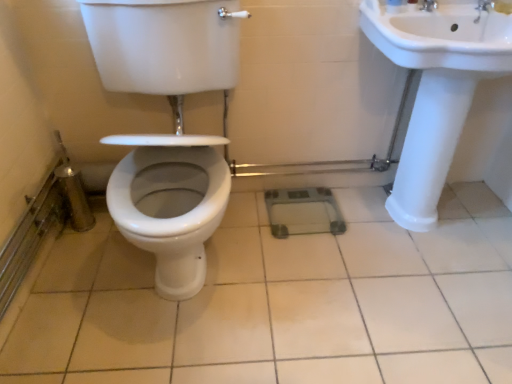
Question: Is white glossy toilet at center positioned behind silver metallic faucet at upper right?

Choices:
 (A) no
 (B) yes

Answer: (A)

Question: From the image's perspective, would you say white glossy toilet at center is shown under silver metallic faucet at upper right?

Choices:
 (A) no
 (B) yes

Answer: (B)

Question: Considering the relative sizes of white glossy toilet at center and silver metallic faucet at upper right in the image provided, is white glossy toilet at center thinner than silver metallic faucet at upper right?

Choices:
 (A) no
 (B) yes

Answer: (A)

Question: Are white glossy toilet at center and silver metallic faucet at upper right located far from each other?

Choices:
 (A) no
 (B) yes

Answer: (B)

Question: Could you tell me if white glossy toilet at center is turned towards silver metallic faucet at upper right?

Choices:
 (A) no
 (B) yes

Answer: (A)

Question: Is white glossy toilet at center bigger than silver metallic faucet at upper right?

Choices:
 (A) no
 (B) yes

Answer: (B)

Question: Is white glossy sink at right far away from silver metallic faucet at upper right?

Choices:
 (A) no
 (B) yes

Answer: (A)

Question: From the image's perspective, is white glossy sink at right on silver metallic faucet at upper right?

Choices:
 (A) no
 (B) yes

Answer: (A)

Question: From the image's perspective, is white glossy sink at right under silver metallic faucet at upper right?

Choices:
 (A) no
 (B) yes

Answer: (B)

Question: Can you confirm if white glossy sink at right is smaller than silver metallic faucet at upper right?

Choices:
 (A) yes
 (B) no

Answer: (B)

Question: From a real-world perspective, is white glossy sink at right physically above silver metallic faucet at upper right?

Choices:
 (A) yes
 (B) no

Answer: (B)

Question: Can you confirm if white glossy sink at right is bigger than silver metallic faucet at upper right?

Choices:
 (A) no
 (B) yes

Answer: (B)

Question: From a real-world perspective, is white glossy toilet at center positioned under white glossy tile at center based on gravity?

Choices:
 (A) yes
 (B) no

Answer: (B)